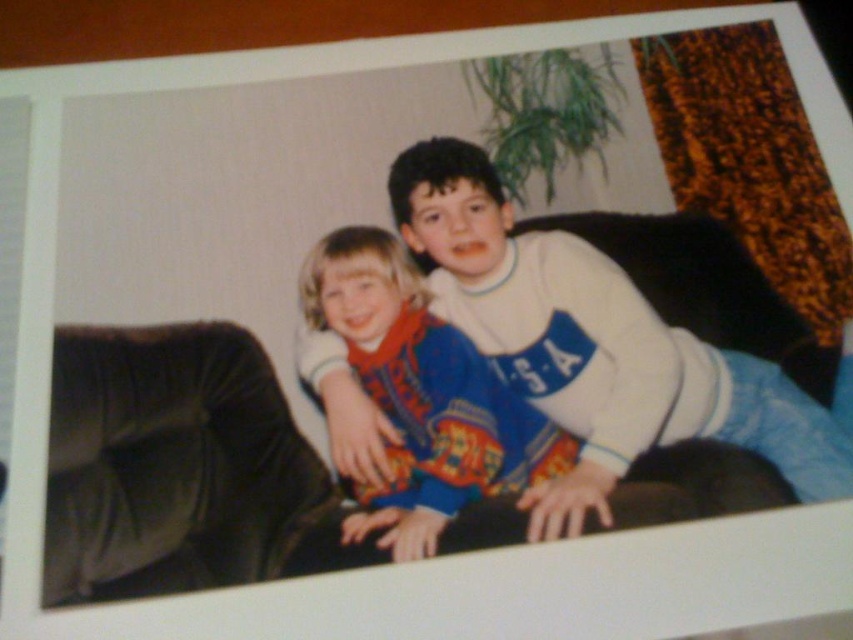
You are a photographer trying to capture a closeup shot of the white cotton shirt at center. Based on the scene description, can you determine the exact coordinates where you should focus your camera lens to ensure the shirt is in the center of the frame?

The white cotton shirt at center is located at coordinates point (532,268), so you should focus your camera lens at those coordinates to center the shirt in the frame.

What are the coordinates of the velvet brown couch at center?

The coordinates of the velvet brown couch at center are at point (178, 467).

Looking at this image, you are a tailor who needs to adjust the length of two cotton shirts displayed in the image. The shirts are the white cotton shirt at center and the blue cotton shirt at center. Which shirt requires a shorter hem adjustment to match the other?

The blue cotton shirt at center is shorter than the white cotton shirt at center. To match their lengths, the white cotton shirt at center should be shortened, making the blue cotton shirt at center the reference for the desired length.